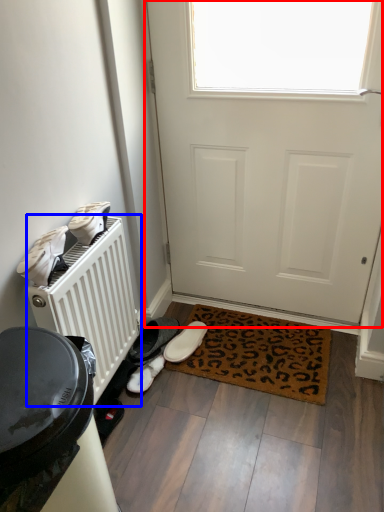
Question: Which object appears closest to the camera in this image, door (highlighted by a red box) or radiator (highlighted by a blue box)?

Choices:
 (A) door
 (B) radiator

Answer: (B)